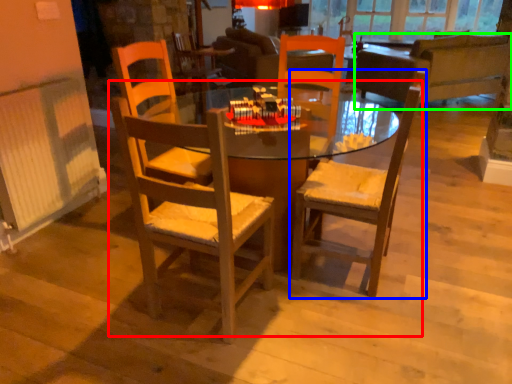
Question: Based on their relative distances, which object is nearer to kitchen & dining room table (highlighted by a red box)? Choose from chair (highlighted by a blue box) and studio couch (highlighted by a green box).

Choices:
 (A) chair
 (B) studio couch

Answer: (A)